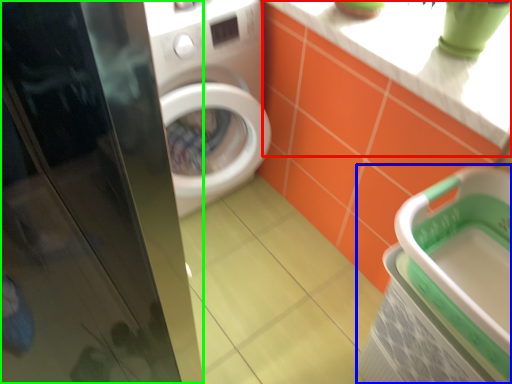
Question: Based on their relative distances, which object is nearer to counter top (highlighted by a red box)? Choose from dish washer (highlighted by a blue box) and screen door (highlighted by a green box).

Choices:
 (A) dish washer
 (B) screen door

Answer: (A)